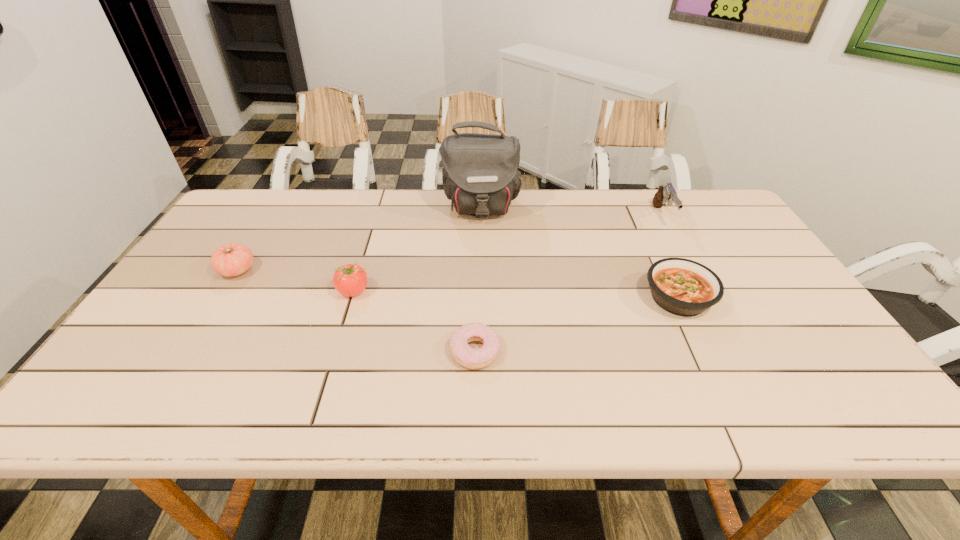
The width and height of the screenshot is (960, 540). In the image, there is a desktop. Find the location of `free space at the far right corner`. free space at the far right corner is located at coordinates (692, 193).

Identify the location of blank region between the stew and the tallest object. (579, 253).

At what (x,y) coordinates should I click in order to perform the action: click on empty location between the tallest object and the left tomato. Please return your answer as a coordinate pair (x, y). This screenshot has width=960, height=540. Looking at the image, I should click on (359, 239).

What are the coordinates of `free space between the shoulder bag and the leftmost object` in the screenshot? It's located at (359, 239).

Image resolution: width=960 pixels, height=540 pixels. Find the location of `free space that is in between the shoulder bag and the fifth shortest object`. free space that is in between the shoulder bag and the fifth shortest object is located at coordinates (571, 212).

Locate an element on the screen. This screenshot has width=960, height=540. vacant area that lies between the tallest object and the fifth object from right to left is located at coordinates (417, 249).

This screenshot has height=540, width=960. What are the coordinates of `free space between the leftmost object and the nearest object` in the screenshot? It's located at (356, 310).

This screenshot has height=540, width=960. What are the coordinates of `vacant area that lies between the shoulder bag and the left tomato` in the screenshot? It's located at (359, 239).

Identify the location of vacant area that lies between the shoulder bag and the left tomato. (359, 239).

I want to click on free space between the second object from left to right and the tallest object, so click(x=417, y=249).